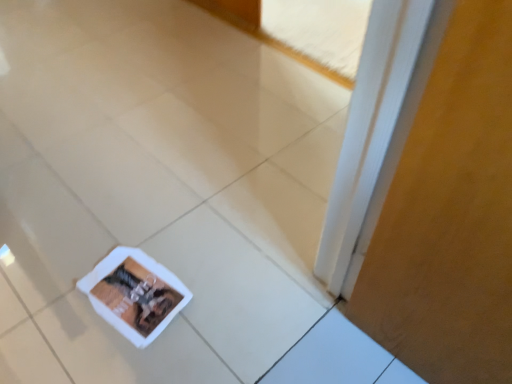
Identify the location of vacant area that is in front of white glossy magazine at lower left. (132, 362).